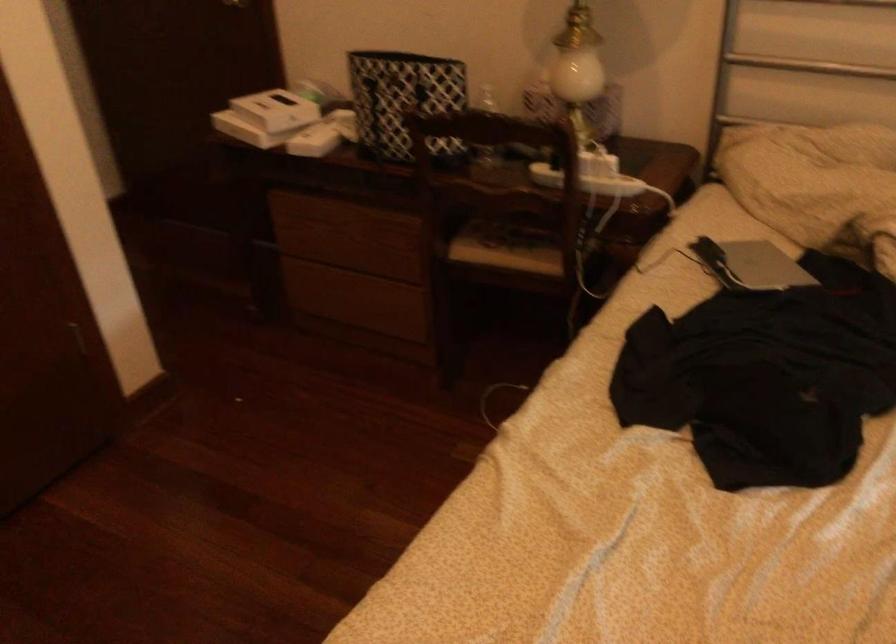
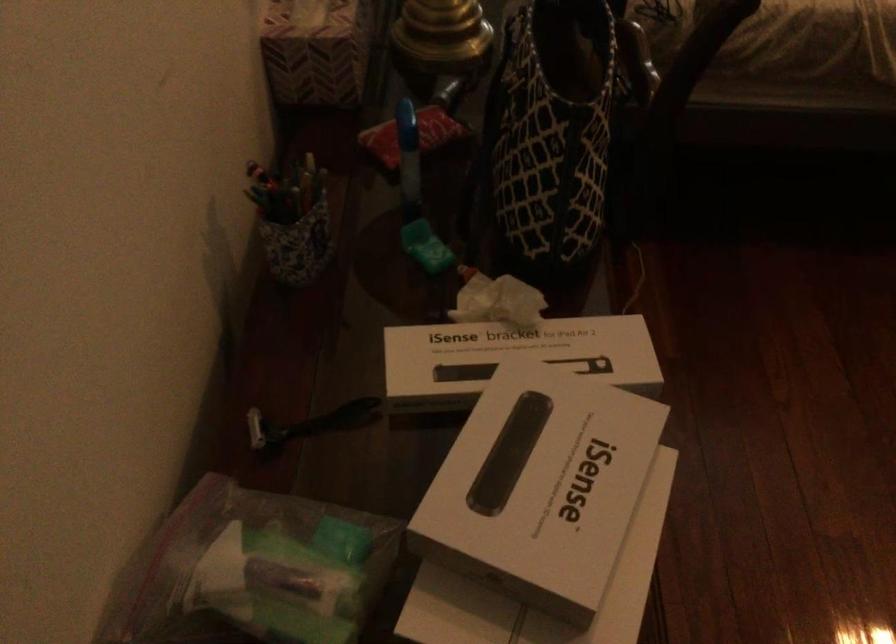
Where in the second image is the point corresponding to (297,82) from the first image?

(252, 571)